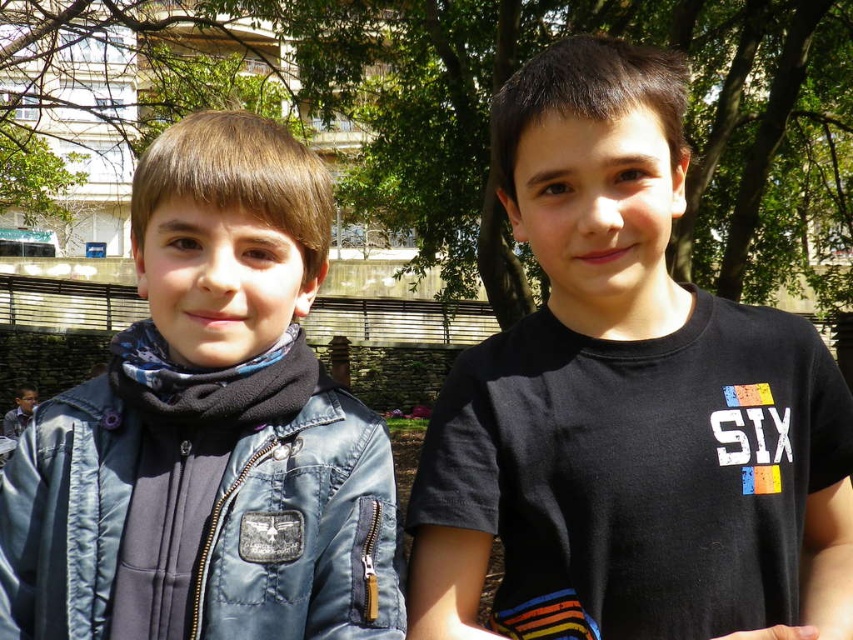
You are trying to decide which clothing item to take for a photoshoot. The scene has two boys in a park setting. The black matte shirt at center is worn by one boy, and the brushed denim jacket at left is worn by another. Based on their sizes, which clothing item would you choose if you want something that stands out more visually?

The black matte shirt at center is bigger than the brushed denim jacket at left, so it would stand out more visually due to its larger size.

In the scene shown: You are a photographer trying to capture a closeup of the black matte shirt at center and the brushed denim jacket at left. Based on their positions, which one would be in focus if you focus on the middle of the image?

The black matte shirt at center is located above the brushed denim jacket at left. If focusing on the middle of the image, the black matte shirt at center would be in focus since it is positioned closer to the focal point.

You are standing at the origin point in the image. Two points are marked in the scene. Which of the two points, point (564,458) or point (9,563), is farther away from you?

Point (564,458) is behind point (9,563), so it is farther away from you.